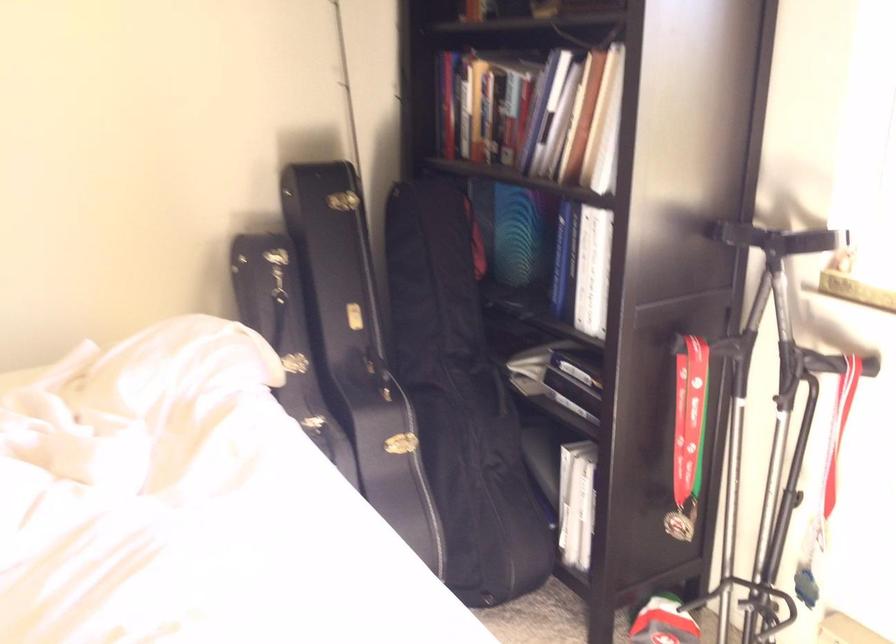
At what (x,y) coordinates should I click in order to perform the action: click on red medal ribbon. Please return your answer as a coordinate pair (x, y). Looking at the image, I should click on (839, 429).